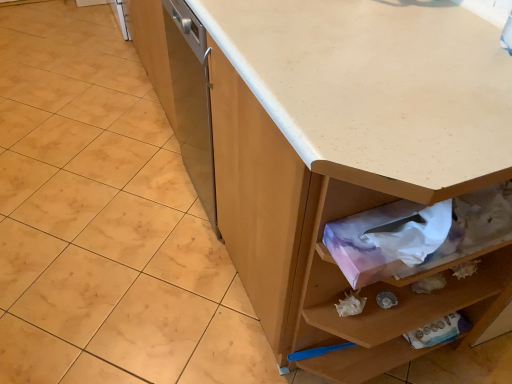
Question: Considering the relative sizes of white laminate countertop at center and white matte granite at center in the image provided, is white laminate countertop at center smaller than white matte granite at center?

Choices:
 (A) yes
 (B) no

Answer: (B)

Question: Does white laminate countertop at center come behind white matte granite at center?

Choices:
 (A) no
 (B) yes

Answer: (A)

Question: Is white laminate countertop at center looking in the opposite direction of white matte granite at center?

Choices:
 (A) yes
 (B) no

Answer: (B)

Question: Is white laminate countertop at center not within white matte granite at center?

Choices:
 (A) yes
 (B) no

Answer: (A)

Question: Could white matte granite at center be considered to be inside white laminate countertop at center?

Choices:
 (A) yes
 (B) no

Answer: (B)

Question: From the image's perspective, is white laminate countertop at center on top of white matte granite at center?

Choices:
 (A) no
 (B) yes

Answer: (A)

Question: Can you confirm if white matte granite at center is smaller than pink paper tissue at lower right?

Choices:
 (A) no
 (B) yes

Answer: (A)

Question: Does white matte granite at center appear on the left side of pink paper tissue at lower right?

Choices:
 (A) no
 (B) yes

Answer: (B)

Question: Is white matte granite at center aimed at pink paper tissue at lower right?

Choices:
 (A) no
 (B) yes

Answer: (A)

Question: Considering the relative sizes of white matte granite at center and pink paper tissue at lower right in the image provided, is white matte granite at center thinner than pink paper tissue at lower right?

Choices:
 (A) yes
 (B) no

Answer: (B)

Question: Is white matte granite at center closer to the viewer compared to pink paper tissue at lower right?

Choices:
 (A) yes
 (B) no

Answer: (B)

Question: Is pink paper tissue at lower right completely or partially inside white matte granite at center?

Choices:
 (A) yes
 (B) no

Answer: (B)

Question: Is the position of white laminate countertop at center more distant than that of pink paper tissue at lower right?

Choices:
 (A) no
 (B) yes

Answer: (A)